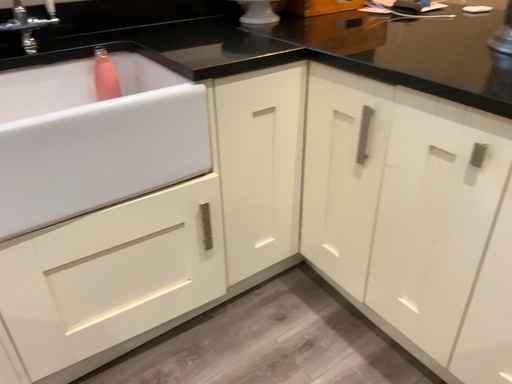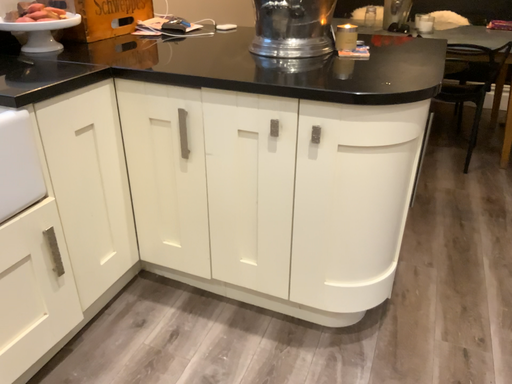
Question: How did the camera likely rotate when shooting the video?

Choices:
 (A) rotated upward
 (B) rotated downward

Answer: (A)